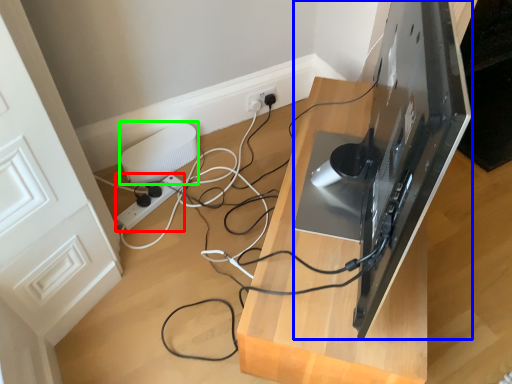
Question: Which object is positioned closest to extension cord (highlighted by a red box)? Select from desktop computer (highlighted by a blue box) and appliance (highlighted by a green box).

Choices:
 (A) desktop computer
 (B) appliance

Answer: (B)